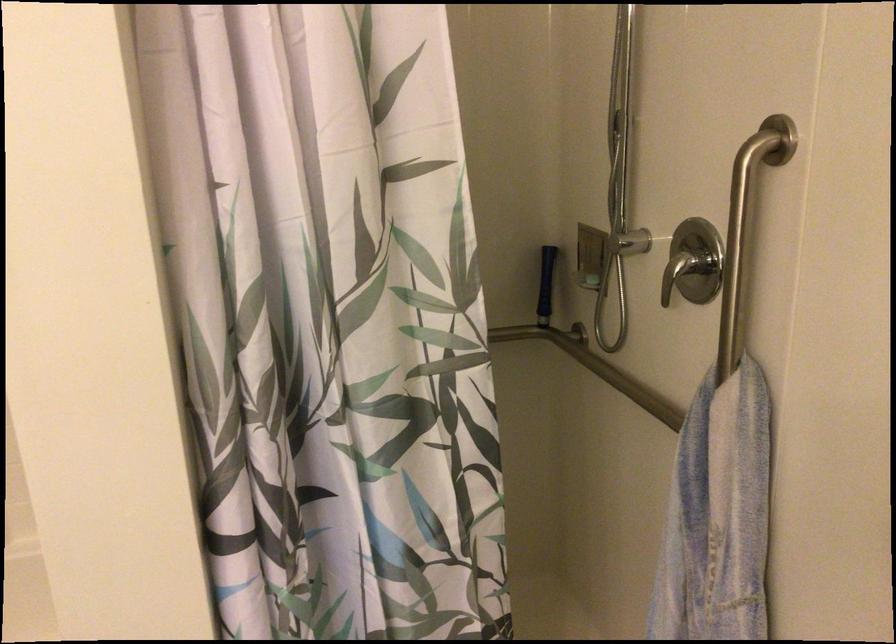
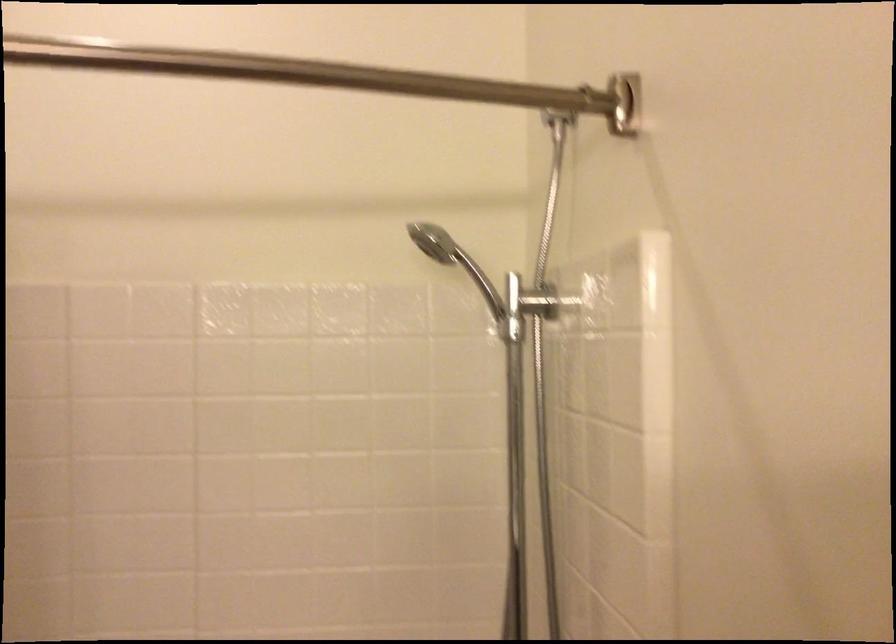
First-person continuous shooting, in which direction is the camera rotating?

The rotation direction of the camera is left-up.